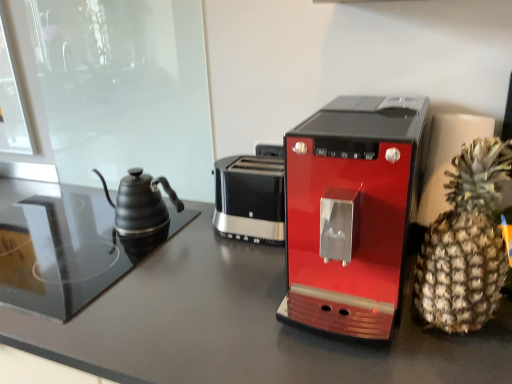
Locate an element on the screen. This screenshot has width=512, height=384. free region on the left part of matte black kettle at left is located at coordinates (62, 231).